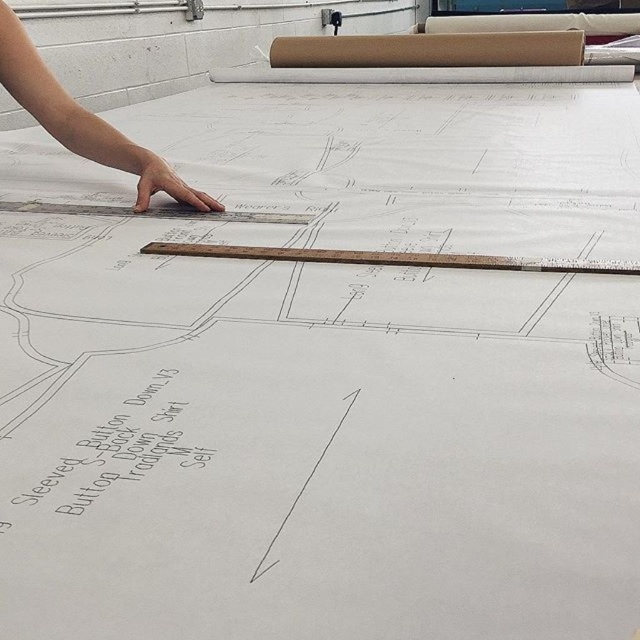
You are a tailor working on a sewing project. You need to determine which object is larger in size between the skinny hand at upper left and the wooden ruler at center. Which one is bigger?

The skinny hand at upper left is bigger than wooden ruler at center according to the description provided.